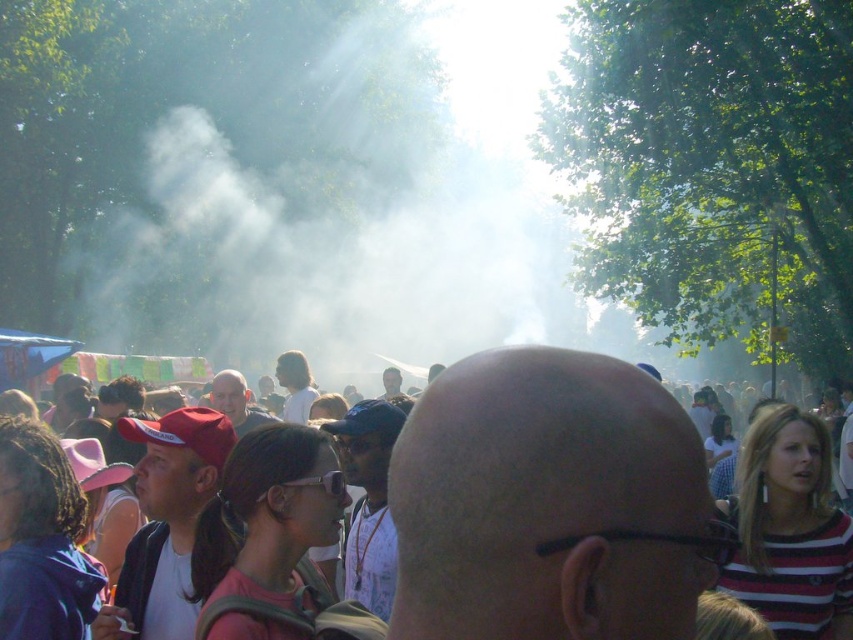
Does point (215, 419) lie in front of point (242, 394)?

Yes, point (215, 419) is closer to viewer.

Is matte red cap at center-left shorter than matte black shirt at center?

No.

This screenshot has width=853, height=640. What do you see at coordinates (166, 522) in the screenshot?
I see `matte red cap at center-left` at bounding box center [166, 522].

You are a GUI agent. You are given a task and a screenshot of the screen. Output one action in this format:
    pyautogui.click(x=<x>, y=<y>)
    Task: Click on the matte red cap at center-left
    The height and width of the screenshot is (640, 853).
    Given the screenshot: What is the action you would take?
    pyautogui.click(x=166, y=522)

Does white vapor at upper center have a larger size compared to matte black shirt at center?

Correct, white vapor at upper center is larger in size than matte black shirt at center.

Which of these two, white vapor at upper center or matte black shirt at center, stands taller?

white vapor at upper center

Identify the location of white vapor at upper center. This screenshot has width=853, height=640. (352, 212).

Who is shorter, white matte shirt at center or matte white shirt at center?

Standing shorter between the two is matte white shirt at center.

Identify the location of white matte shirt at center. (368, 502).

Between point (387, 614) and point (380, 396), which one is positioned behind?

Positioned behind is point (380, 396).

At what (x,y) coordinates should I click in order to perform the action: click on white matte shirt at center. Please return your answer as a coordinate pair (x, y). Looking at the image, I should click on (368, 502).